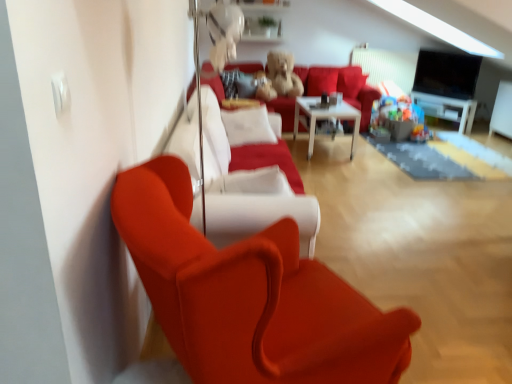
In order to click on satin red couch at center in this screenshot , I will do `click(248, 192)`.

Describe the element at coordinates (248, 126) in the screenshot. I see `white soft cushion at center` at that location.

The height and width of the screenshot is (384, 512). I want to click on white soft cushion at center, so click(x=248, y=126).

This screenshot has height=384, width=512. What are the coordinates of `satin red armchair at left` in the screenshot? It's located at (250, 295).

What is the approximate height of white glossy table at center?

21.58 inches.

Measure the distance between white glossy table at center and camera.

A distance of 14.76 feet exists between white glossy table at center and camera.

Where is `satin red couch at center`? This screenshot has height=384, width=512. satin red couch at center is located at coordinates (248, 192).

Is velvet red couch at center facing away from white glossy table at center?

No, velvet red couch at center's orientation is not away from white glossy table at center.

Who is bigger, velvet red couch at center or white glossy table at center?

velvet red couch at center.

From the image's perspective, which is above, velvet red couch at center or white glossy table at center?

velvet red couch at center.

Find the location of a particular element. The image size is (512, 384). entertainment center located above the white soft cushion at center (from the image's perspective) is located at coordinates (447, 109).

Is white glossy entertainment center at right behind white soft cushion at center?

That is True.

Could you tell me if white glossy entertainment center at right is turned towards white soft cushion at center?

Yes, white glossy entertainment center at right is oriented towards white soft cushion at center.

Is white glossy entertainment center at right in contact with white soft cushion at center?

No, white glossy entertainment center at right is not making contact with white soft cushion at center.

Would you consider fuzzy brown teddy bear at center to be distant from white glossy entertainment center at right?

Yes, fuzzy brown teddy bear at center is far from white glossy entertainment center at right.

Considering the relative sizes of fuzzy brown teddy bear at center and white glossy entertainment center at right in the image provided, is fuzzy brown teddy bear at center smaller than white glossy entertainment center at right?

No.

Considering the relative positions of fuzzy brown teddy bear at center and white glossy entertainment center at right in the image provided, is fuzzy brown teddy bear at center to the right of white glossy entertainment center at right from the viewer's perspective?

In fact, fuzzy brown teddy bear at center is to the left of white glossy entertainment center at right.

From the image's perspective, which one is positioned lower, fuzzy brown teddy bear at center or white glossy entertainment center at right?

white glossy entertainment center at right, from the image's perspective.

What's the angular difference between white glossy table at center and satin red couch at center's facing directions?

The facing directions of white glossy table at center and satin red couch at center are 87.7 degrees apart.

Is white glossy table at center looking in the opposite direction of satin red couch at center?

white glossy table at center is not turned away from satin red couch at center.

Is satin red couch at center completely or partially inside white glossy table at center?

No.

Is velvet red couch at center beside satin red armchair at left?

They are not placed beside each other.

Between velvet red couch at center and satin red armchair at left, which one has less height?

Standing shorter between the two is velvet red couch at center.

Considering the sizes of velvet red couch at center and satin red armchair at left in the image, is velvet red couch at center bigger or smaller than satin red armchair at left?

velvet red couch at center is bigger than satin red armchair at left.

Is the position of velvet red couch at center less distant than that of satin red armchair at left?

No.

Is white soft cushion at center shorter than white glossy entertainment center at right?

No.

Between white soft cushion at center and white glossy entertainment center at right, which one is positioned behind?

white glossy entertainment center at right is further from the camera.

Could you tell me if white soft cushion at center is facing white glossy entertainment center at right?

No, white soft cushion at center is not turned towards white glossy entertainment center at right.

Find the location of a particular element. This screenshot has height=384, width=512. pillow below the white glossy entertainment center at right (from the image's perspective) is located at coordinates (248, 126).

Considering the positions of objects satin red armchair at left and velvet red couch at center in the image provided, who is in front, satin red armchair at left or velvet red couch at center?

satin red armchair at left.

From the image's perspective, is satin red armchair at left over velvet red couch at center?

Incorrect, from the image's perspective, satin red armchair at left is lower than velvet red couch at center.

Can you confirm if satin red armchair at left is wider than velvet red couch at center?

In fact, satin red armchair at left might be narrower than velvet red couch at center.

Locate an element on the screen. The width and height of the screenshot is (512, 384). studio couch on the left of white glossy table at center is located at coordinates (364, 104).

At what (x,y) coordinates should I click in order to perform the action: click on pillow that is in front of the white glossy entertainment center at right. Please return your answer as a coordinate pair (x, y). This screenshot has height=384, width=512. Looking at the image, I should click on (248, 126).

From the image, which object appears to be nearer to white glossy entertainment center at right, fuzzy brown teddy bear at center or white soft cushion at center?

fuzzy brown teddy bear at center lies closer to white glossy entertainment center at right than the other object.

From the image, which object appears to be farther from white soft cushion at center, satin red armchair at left or velvet red couch at center?

satin red armchair at left.

Estimate the real-world distances between objects in this image. Which object is further from velvet red couch at center, white glossy table at center or satin red armchair at left?

satin red armchair at left.

Looking at the image, which one is located closer to velvet red couch at center, white glossy entertainment center at right or fuzzy brown teddy bear at center?

fuzzy brown teddy bear at center lies closer to velvet red couch at center than the other object.

In the scene shown: Which object lies further to the anchor point white soft cushion at center, white glossy table at center or satin red armchair at left?

satin red armchair at left is further to white soft cushion at center.

Based on their spatial positions, is satin red couch at center or fuzzy brown teddy bear at center further from white glossy table at center?

satin red couch at center is positioned further to the anchor white glossy table at center.

Estimate the real-world distances between objects in this image. Which object is further from satin red armchair at left, fuzzy brown teddy bear at center or velvet red couch at center?

velvet red couch at center lies further to satin red armchair at left than the other object.

Estimate the real-world distances between objects in this image. Which object is further from velvet red couch at center, white glossy entertainment center at right or satin red armchair at left?

satin red armchair at left lies further to velvet red couch at center than the other object.

Locate an element on the screen. Image resolution: width=512 pixels, height=384 pixels. pillow positioned between satin red armchair at left and fuzzy brown teddy bear at center from near to far is located at coordinates (248, 126).

Find the location of a particular element. The width and height of the screenshot is (512, 384). table between satin red couch at center and fuzzy brown teddy bear at center from front to back is located at coordinates (324, 118).

Locate an element on the screen. This screenshot has height=384, width=512. pillow positioned between satin red armchair at left and white glossy table at center from near to far is located at coordinates (248, 126).

You are a GUI agent. You are given a task and a screenshot of the screen. Output one action in this format:
    pyautogui.click(x=<x>, y=<y>)
    Task: Click on the table between satin red couch at center and velvet red couch at center in the front-back direction
    The height and width of the screenshot is (384, 512).
    Given the screenshot: What is the action you would take?
    pyautogui.click(x=324, y=118)